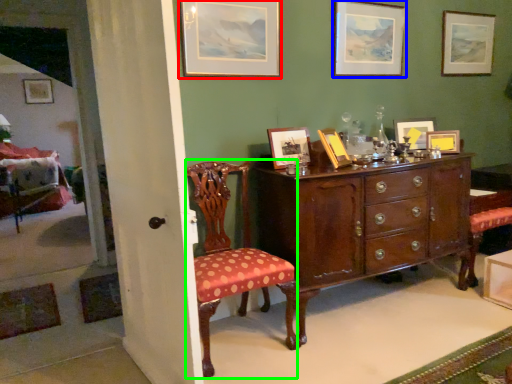
Question: Considering the real-world distances, which object is closest to picture frame (highlighted by a red box)? picture frame (highlighted by a blue box) or chair (highlighted by a green box).

Choices:
 (A) picture frame
 (B) chair

Answer: (A)